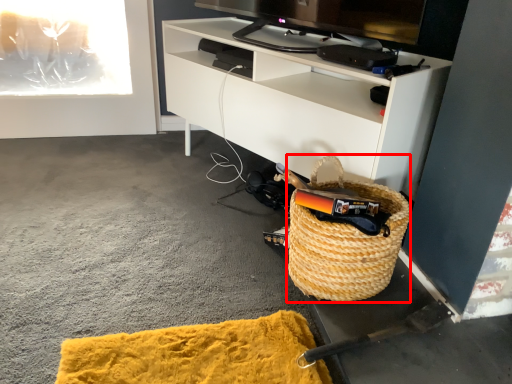
Question: Considering the relative positions of picnic basket (annotated by the red box) and cabinetry in the image provided, where is picnic basket (annotated by the red box) located with respect to the staircase?

Choices:
 (A) left
 (B) right

Answer: (B)